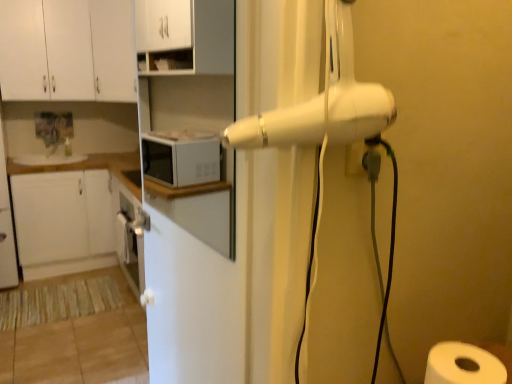
Question: In terms of height, does white glossy counter top at upper left look taller or shorter compared to white matte cabinet at left, the 1th cabinetry from the bottom?

Choices:
 (A) short
 (B) tall

Answer: (A)

Question: Is white glossy counter top at upper left in front of or behind white matte cabinet at left, the fourth cabinetry when ordered from top to bottom, in the image?

Choices:
 (A) behind
 (B) front

Answer: (A)

Question: Which is nearer to the white plastic hair dryer at upper right?

Choices:
 (A) white glossy counter top at upper left
 (B) white paper at lower right
 (C) white matte cabinet at upper left, the first cabinetry from the top
 (D) white matte cabinet at upper left, which ranks as the third cabinetry in bottom-to-top order
 (E) white matte cabinet at upper center, the second cabinetry positioned from the bottom

Answer: (B)

Question: Which object is positioned closest to the white matte cabinet at upper left, which ranks as the third cabinetry in bottom-to-top order?

Choices:
 (A) white matte cabinet at left, the fourth cabinetry when ordered from top to bottom
 (B) white glossy counter top at upper left
 (C) white glossy screen door at center
 (D) white matte cabinet at upper center, the second cabinetry positioned from the bottom
 (E) white plastic hair dryer at upper right

Answer: (C)